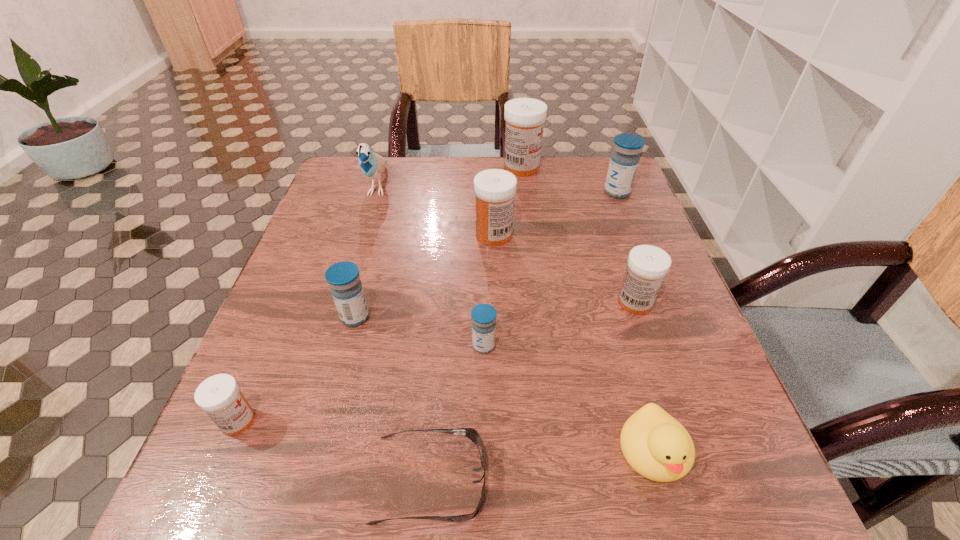
Identify which object is the eighth closest to the second nearest white medicine. Please provide its 2D coordinates. Your answer should be formatted as a tuple, i.e. [(x, y)], where the tuple contains the x and y coordinates of a point satisfying the conditions above.

[(372, 165)]

This screenshot has width=960, height=540. I want to click on the third closest medicine to the tallest medicine, so pos(647,265).

Find the location of a particular element. the seventh closest medicine relative to the yellow duckling is located at coordinates (525, 117).

Identify the location of white medicine that is the second closest one to the fourth farthest object. Image resolution: width=960 pixels, height=540 pixels. (647, 265).

Locate an element on the screen. white medicine that is the closest to the leftmost white medicine is located at coordinates pos(495,189).

Identify which blue medicine is the closest to the farthest blue medicine. Please provide its 2D coordinates. Your answer should be formatted as a tuple, i.e. [(x, y)], where the tuple contains the x and y coordinates of a point satisfying the conditions above.

[(483, 315)]

Select which blue medicine is the second closest to the sunglasses. Please provide its 2D coordinates. Your answer should be formatted as a tuple, i.e. [(x, y)], where the tuple contains the x and y coordinates of a point satisfying the conditions above.

[(343, 277)]

This screenshot has width=960, height=540. Find the location of `blank space that satisfies the following two spatial constraints: 1. at the face of the farthest blue medicine; 2. on the right side of the bird`. blank space that satisfies the following two spatial constraints: 1. at the face of the farthest blue medicine; 2. on the right side of the bird is located at coordinates (376, 192).

Where is `blank area in the image that satisfies the following two spatial constraints: 1. at the face of the second smallest white medicine; 2. on the right side of the blue bird`? This screenshot has height=540, width=960. blank area in the image that satisfies the following two spatial constraints: 1. at the face of the second smallest white medicine; 2. on the right side of the blue bird is located at coordinates (343, 302).

You are a GUI agent. You are given a task and a screenshot of the screen. Output one action in this format:
    pyautogui.click(x=<x>, y=<y>)
    Task: Click on the vacant region that satisfies the following two spatial constraints: 1. at the face of the bird; 2. on the right side of the rightmost white medicine
    
    Given the screenshot: What is the action you would take?
    [x=343, y=302]